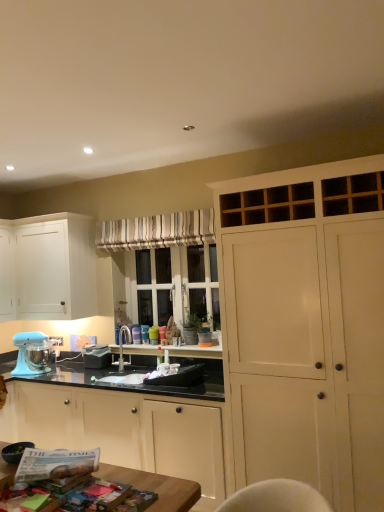
Question: Which direction should I rotate to look at matte white cabinet at center, which is counted as the second cabinetry, starting from the right?

Choices:
 (A) left
 (B) right

Answer: (A)

Question: Would you say striped fabric curtain at center is part of matte black coffee maker at center's contents?

Choices:
 (A) yes
 (B) no

Answer: (B)

Question: From a real-world perspective, is matte black coffee maker at center physically below striped fabric curtain at center?

Choices:
 (A) no
 (B) yes

Answer: (B)

Question: Does matte black coffee maker at center have a greater height compared to striped fabric curtain at center?

Choices:
 (A) no
 (B) yes

Answer: (A)

Question: Would you say matte black coffee maker at center is outside striped fabric curtain at center?

Choices:
 (A) yes
 (B) no

Answer: (A)

Question: Is matte black coffee maker at center smaller than striped fabric curtain at center?

Choices:
 (A) no
 (B) yes

Answer: (B)

Question: Does matte black coffee maker at center turn towards striped fabric curtain at center?

Choices:
 (A) no
 (B) yes

Answer: (A)

Question: Can you confirm if matte white cabinet at center, the 2th cabinetry from the left, is positioned to the right of white matte cabinet at left, acting as the 1th cabinetry starting from the left?

Choices:
 (A) yes
 (B) no

Answer: (A)

Question: Considering the relative sizes of matte white cabinet at center, which is counted as the second cabinetry, starting from the right, and white matte cabinet at left, acting as the 1th cabinetry starting from the left, in the image provided, is matte white cabinet at center, which is counted as the second cabinetry, starting from the right, taller than white matte cabinet at left, acting as the 1th cabinetry starting from the left,?

Choices:
 (A) no
 (B) yes

Answer: (B)

Question: Could you tell me if matte white cabinet at center, the 2th cabinetry from the left, is turned towards white matte cabinet at left, which is counted as the 3th cabinetry, starting from the right?

Choices:
 (A) no
 (B) yes

Answer: (A)

Question: Is matte white cabinet at center, the 2th cabinetry from the left, smaller than white matte cabinet at left, which is counted as the 3th cabinetry, starting from the right?

Choices:
 (A) yes
 (B) no

Answer: (B)

Question: From a real-world perspective, does matte white cabinet at center, which is counted as the second cabinetry, starting from the right, stand above white matte cabinet at left, which is counted as the 3th cabinetry, starting from the right?

Choices:
 (A) no
 (B) yes

Answer: (A)

Question: Is matte white cabinet at center, which is counted as the second cabinetry, starting from the right, located outside white matte cabinet at left, which is counted as the 3th cabinetry, starting from the right?

Choices:
 (A) yes
 (B) no

Answer: (A)

Question: Can matte white cabinet at center, which is counted as the second cabinetry, starting from the right, be found inside satin nickel faucet at center?

Choices:
 (A) yes
 (B) no

Answer: (B)